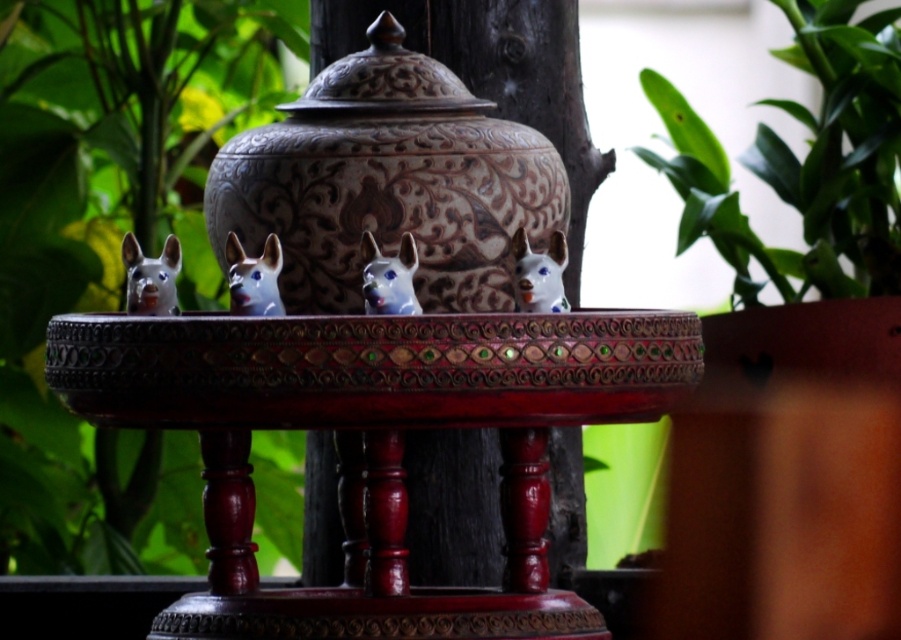
Question: Which object appears closest to the camera in this image?

Choices:
 (A) green leafy plant at upper right
 (B) white glossy dog head at center
 (C) blue glossy dog head at center
 (D) porcelain dog at center

Answer: (D)

Question: Is the position of green leafy plant at upper right more distant than that of blue glossy dog head at center?

Choices:
 (A) no
 (B) yes

Answer: (B)

Question: Can you confirm if green leafy plant at upper right is positioned below porcelain dog at center?

Choices:
 (A) yes
 (B) no

Answer: (B)

Question: Which of the following is the farthest from the observer?

Choices:
 (A) blue glossy dog head at center
 (B) green leafy plant at upper right
 (C) matte gray dog head at left
 (D) polished wood table at center

Answer: (B)

Question: Does polished wood table at center appear on the right side of green leafy plant at center?

Choices:
 (A) no
 (B) yes

Answer: (B)

Question: Which of the following is the farthest from the observer?

Choices:
 (A) white glossy dog head at center
 (B) green leafy plant at upper right

Answer: (B)